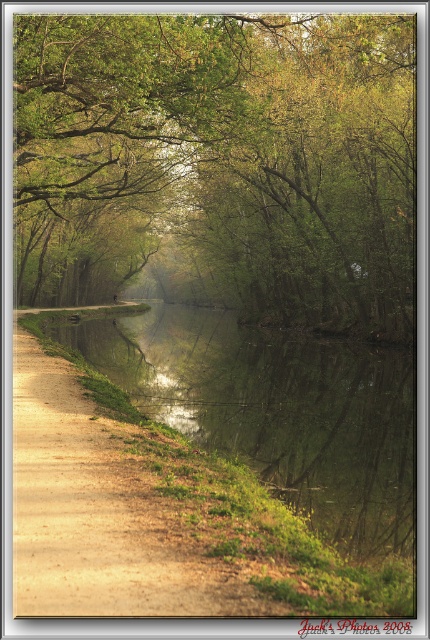
Is green reflective water at center thinner than brown dirt path at left?

Incorrect, green reflective water at center's width is not less than brown dirt path at left's.

Does green reflective water at center have a greater width compared to brown dirt path at left?

Indeed, green reflective water at center has a greater width compared to brown dirt path at left.

In order to click on green reflective water at center in this screenshot , I will do `click(276, 410)`.

Between green leafy trees at center and brown dirt path at left, which one appears on the left side from the viewer's perspective?

Positioned to the left is green leafy trees at center.

From the picture: Does green leafy trees at center appear over brown dirt path at left?

Yes, green leafy trees at center is above brown dirt path at left.

Which is in front, point (217, 262) or point (149, 612)?

Positioned in front is point (149, 612).

This screenshot has height=640, width=430. Identify the location of green leafy trees at center. (221, 164).

In the scene shown: Which is below, green leafy trees at center or green reflective water at center?

green reflective water at center is lower down.

Is green leafy trees at center below green reflective water at center?

No.

Does point (168, 74) come in front of point (183, 330)?

Yes, it is.

At what (x,y) coordinates should I click in order to perform the action: click on green leafy trees at center. Please return your answer as a coordinate pair (x, y). The height and width of the screenshot is (640, 430). Looking at the image, I should click on (221, 164).